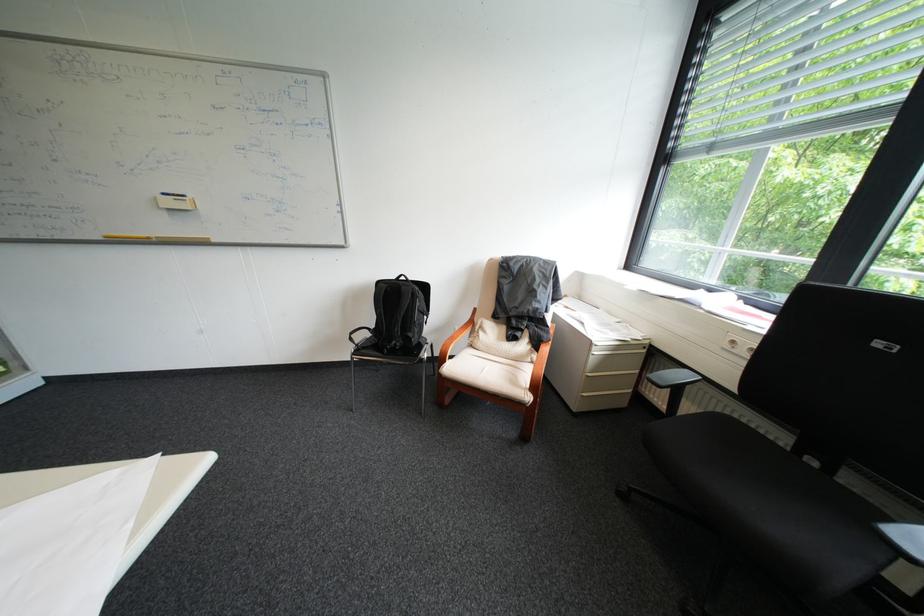
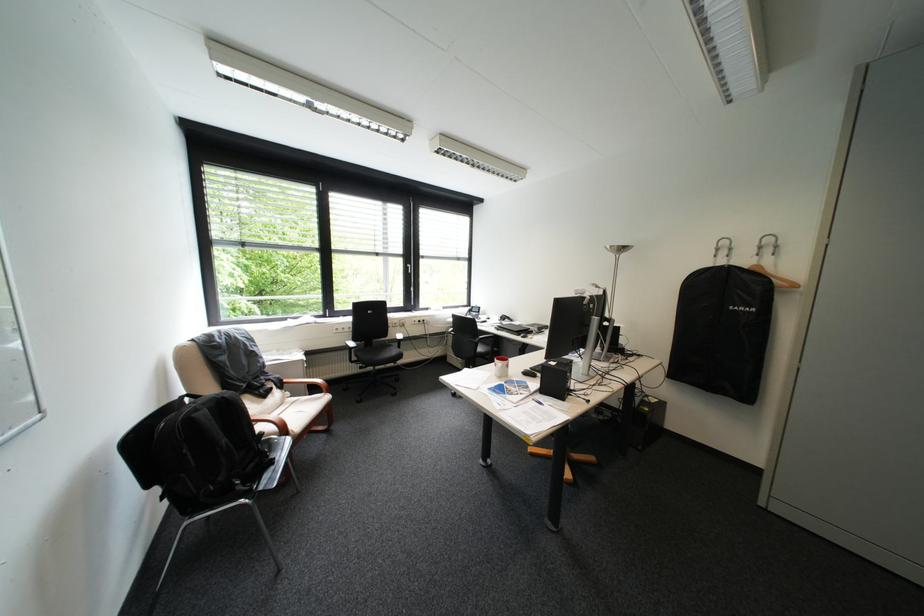
Locate, in the second image, the point that corresponds to pixel 512 339 in the first image.

(272, 403)